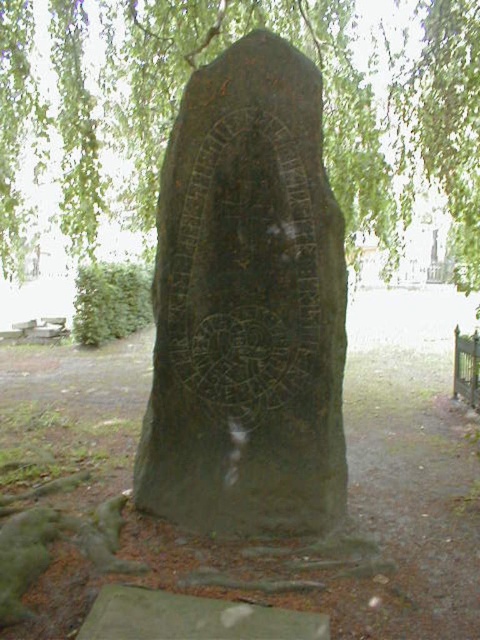
Question: Which of the following is the farthest from the observer?

Choices:
 (A) (156, 332)
 (B) (450, 372)
 (C) (392, 259)

Answer: (B)

Question: Can you confirm if green stone monument at center is positioned below green stone carving at center?

Choices:
 (A) yes
 (B) no

Answer: (B)

Question: Which point is closer to the camera taking this photo?

Choices:
 (A) (386, 420)
 (B) (364, 170)
 (C) (157, 236)

Answer: (C)

Question: Where is green stone monument at center located in relation to green leafy tree at upper center in the image?

Choices:
 (A) right
 (B) left

Answer: (A)

Question: Which of the following is the farthest from the observer?

Choices:
 (A) (380, 72)
 (B) (475, 592)

Answer: (A)

Question: Is green leafy tree at upper center further to the viewer compared to green stone carving at center?

Choices:
 (A) yes
 (B) no

Answer: (A)